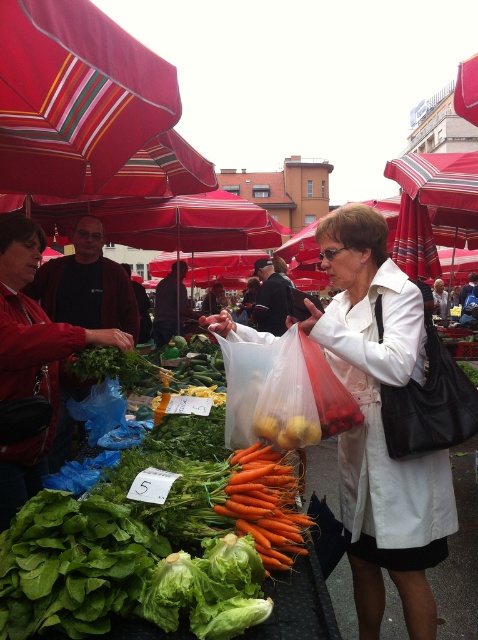
Question: Is white fabric coat at center to the left of matte black jacket at center from the viewer's perspective?

Choices:
 (A) yes
 (B) no

Answer: (B)

Question: Is fresh green leafy vegetables at center further to camera compared to matte black jacket at center?

Choices:
 (A) yes
 (B) no

Answer: (B)

Question: Which of the following is the farthest from the observer?

Choices:
 (A) (75, 280)
 (B) (66, 604)
 (C) (230, 477)
 (D) (365, 412)

Answer: (A)

Question: Does fresh green leafy vegetables at center appear on the left side of orange matte carrots at center?

Choices:
 (A) yes
 (B) no

Answer: (A)

Question: Which of the following is the farthest from the observer?

Choices:
 (A) fresh green leafy vegetables at center
 (B) matte black jacket at center
 (C) orange matte carrots at center

Answer: (B)

Question: Estimate the real-world distances between objects in this image. Which object is closer to the orange matte carrots at center?

Choices:
 (A) fresh green leafy vegetables at center
 (B) white fabric coat at center

Answer: (A)